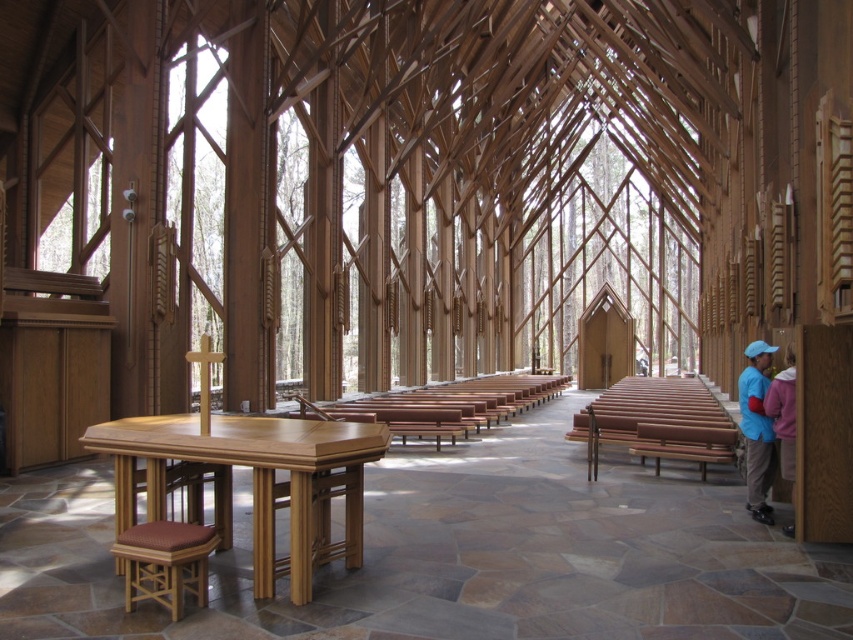
You are standing at the entrance of the modern church and want to place a bouquet of flowers on the light brown wood table at center. Based on the floor plan, can you confirm if the table is positioned closer to the altar or the entrance?

The light brown wood table at center is located at point (252, 481), which places it closer to the entrance than the altar. Therefore, the table is positioned closer to the entrance.

You are standing at the entrance of the modern church and see two points marked on the floor. The first point is at coordinates point (120, 554) and the second is at point (750, 445). Which point is closer to you as you face the altar?

The point (120, 554) is closer to you than point (750, 445) because it is nearer to the camera position when facing the altar.